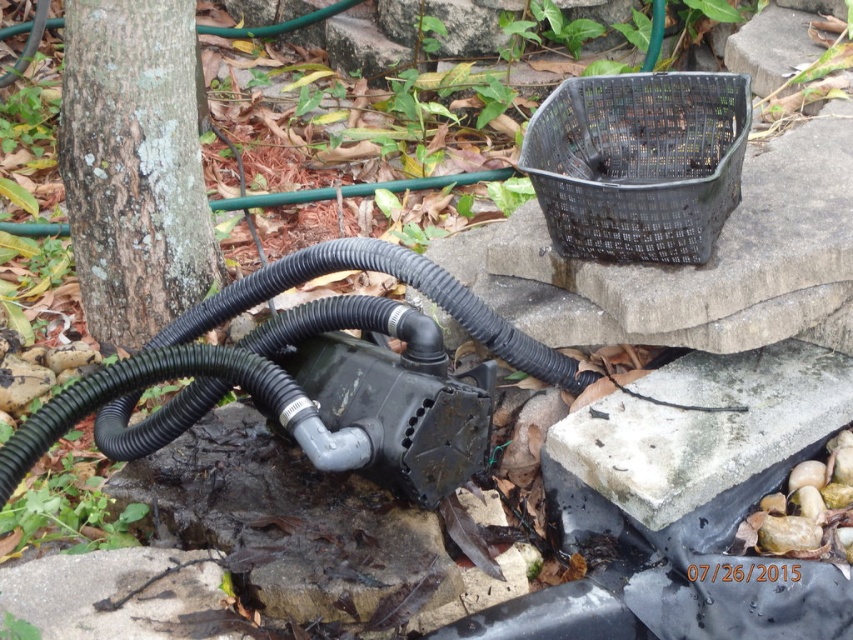
Does point (695, 196) come in front of point (705, 436)?

No, it is behind (705, 436).

Who is positioned more to the right, black plastic basket at upper right or gray concrete block at lower right?

From the viewer's perspective, gray concrete block at lower right appears more on the right side.

Between point (701, 177) and point (604, 417), which one is positioned in front?

Point (604, 417) is more forward.

Find the location of a particular element. The width and height of the screenshot is (853, 640). black plastic basket at upper right is located at coordinates (637, 163).

Is black rubber hose at lower left wider than gray concrete block at lower right?

Yes, black rubber hose at lower left is wider than gray concrete block at lower right.

Which of these two, black rubber hose at lower left or gray concrete block at lower right, stands taller?

black rubber hose at lower left

The width and height of the screenshot is (853, 640). What do you see at coordinates (270, 353) in the screenshot? I see `black rubber hose at lower left` at bounding box center [270, 353].

You are a GUI agent. You are given a task and a screenshot of the screen. Output one action in this format:
    pyautogui.click(x=<x>, y=<y>)
    Task: Click on the black rubber hose at lower left
    The image size is (853, 640).
    Given the screenshot: What is the action you would take?
    pyautogui.click(x=270, y=353)

Does black rubber hose at lower left have a greater height compared to black plastic basket at upper right?

Correct, black rubber hose at lower left is much taller as black plastic basket at upper right.

Does point (103, 392) lie in front of point (573, 81)?

Yes, it is in front of point (573, 81).

The height and width of the screenshot is (640, 853). What do you see at coordinates (270, 353) in the screenshot?
I see `black rubber hose at lower left` at bounding box center [270, 353].

The width and height of the screenshot is (853, 640). Identify the location of black rubber hose at lower left. (270, 353).